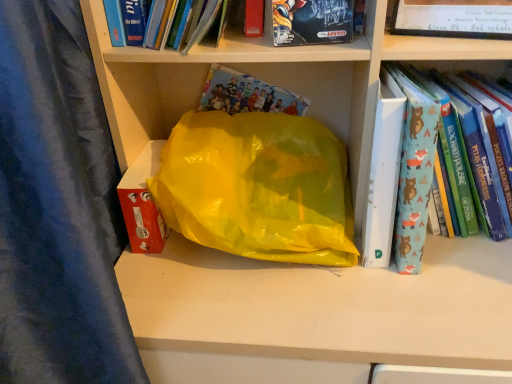
Question: Can you confirm if matt black board game at upper center, the 2th book from the left, is thinner than hardcover book at upper center, the third book from the right?

Choices:
 (A) yes
 (B) no

Answer: (A)

Question: Would you consider matt black board game at upper center, the 2th book from the left, to be distant from hardcover book at upper center, the third book from the right?

Choices:
 (A) yes
 (B) no

Answer: (B)

Question: Can you confirm if matt black board game at upper center, which is the second book from right to left, is taller than hardcover book at upper center, the first book when ordered from left to right?

Choices:
 (A) yes
 (B) no

Answer: (B)

Question: Does matt black board game at upper center, which is the second book from right to left, have a greater width compared to hardcover book at upper center, the first book when ordered from left to right?

Choices:
 (A) no
 (B) yes

Answer: (A)

Question: Does matt black board game at upper center, the 2th book from the left, have a larger size compared to hardcover book at upper center, the third book from the right?

Choices:
 (A) no
 (B) yes

Answer: (A)

Question: From a real-world perspective, is matt black board game at upper center, the 2th book from the left, on top of hardcover book at upper center, the first book when ordered from left to right?

Choices:
 (A) yes
 (B) no

Answer: (B)

Question: Is matt black board game at upper center, which is the second book from right to left, located within blue fabric book at right, which appears as the third book when viewed from the left?

Choices:
 (A) yes
 (B) no

Answer: (B)

Question: Is blue fabric book at right, which appears as the third book when viewed from the left, closer to camera compared to matt black board game at upper center, which is the second book from right to left?

Choices:
 (A) no
 (B) yes

Answer: (A)

Question: Are blue fabric book at right, marked as the 1th book in a right-to-left arrangement, and matt black board game at upper center, the 2th book from the left, far apart?

Choices:
 (A) yes
 (B) no

Answer: (B)

Question: Considering the relative sizes of blue fabric book at right, which appears as the third book when viewed from the left, and matt black board game at upper center, the 2th book from the left, in the image provided, is blue fabric book at right, which appears as the third book when viewed from the left, thinner than matt black board game at upper center, the 2th book from the left,?

Choices:
 (A) no
 (B) yes

Answer: (A)

Question: Does blue fabric book at right, which appears as the third book when viewed from the left, have a smaller size compared to matt black board game at upper center, which is the second book from right to left?

Choices:
 (A) yes
 (B) no

Answer: (B)

Question: Does blue fabric book at right, which appears as the third book when viewed from the left, have a larger size compared to matt black board game at upper center, which is the second book from right to left?

Choices:
 (A) yes
 (B) no

Answer: (A)

Question: Is blue fabric book at right, which appears as the third book when viewed from the left, placed right next to hardcover book at upper center, the third book from the right?

Choices:
 (A) yes
 (B) no

Answer: (B)